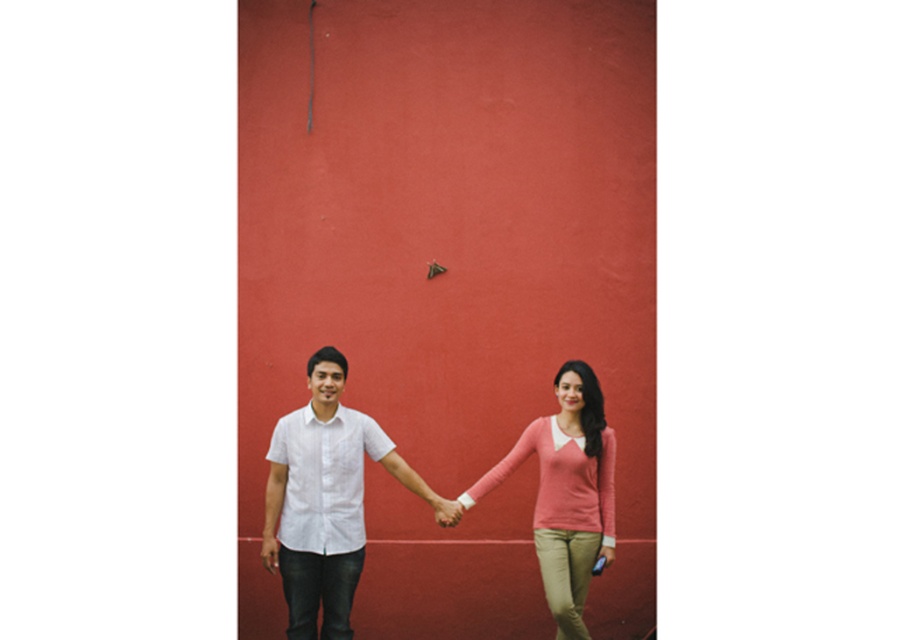
You are an artist planning to paint the scene described. You need to decide which object, the pink sweater at center or the matte pink hand at center, requires more detailed work due to its size. Which one should you focus on?

The pink sweater at center is larger in size than the matte pink hand at center, so you should focus more detailed work on the pink sweater at center.